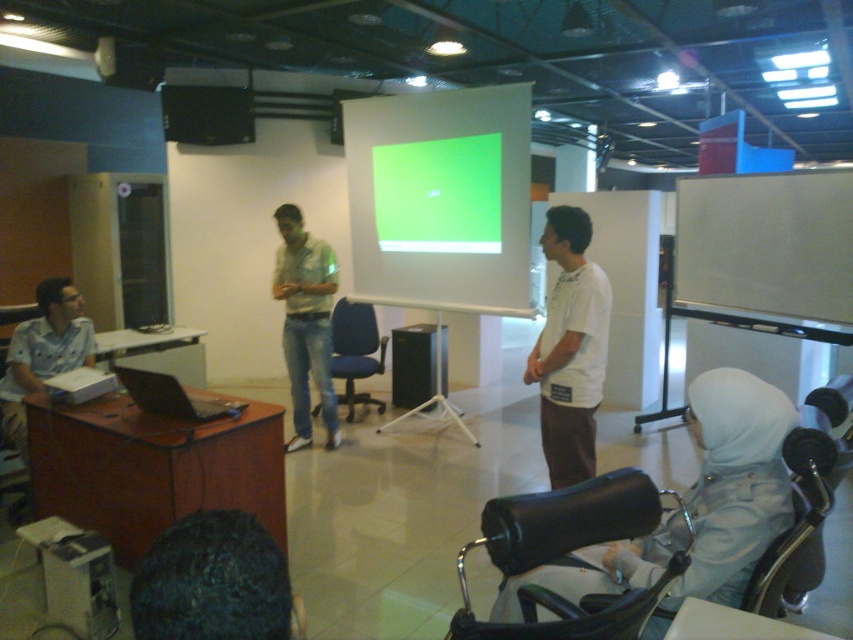
Can you confirm if black leather chair at lower right is bigger than blue fabric chair at center?

No, black leather chair at lower right is not bigger than blue fabric chair at center.

Between black leather chair at lower right and blue fabric chair at center, which one appears on the left side from the viewer's perspective?

blue fabric chair at center

The width and height of the screenshot is (853, 640). Describe the element at coordinates (567, 556) in the screenshot. I see `black leather chair at lower right` at that location.

Identify the location of black leather chair at lower right. The width and height of the screenshot is (853, 640). (567, 556).

Does blue fabric chair at center have a larger size compared to black glossy laptop at left?

Yes.

Locate an element on the screen. The width and height of the screenshot is (853, 640). blue fabric chair at center is located at coordinates (355, 352).

Identify the location of blue fabric chair at center. (355, 352).

Can you confirm if white fabric headscarf at lower right is thinner than black glossy laptop at left?

No, white fabric headscarf at lower right is not thinner than black glossy laptop at left.

Who is more forward, [759,392] or [151,374]?

Point [759,392]

Is point (743, 451) more distant than point (125, 365)?

That is False.

Locate an element on the screen. The width and height of the screenshot is (853, 640). white fabric headscarf at lower right is located at coordinates (733, 483).